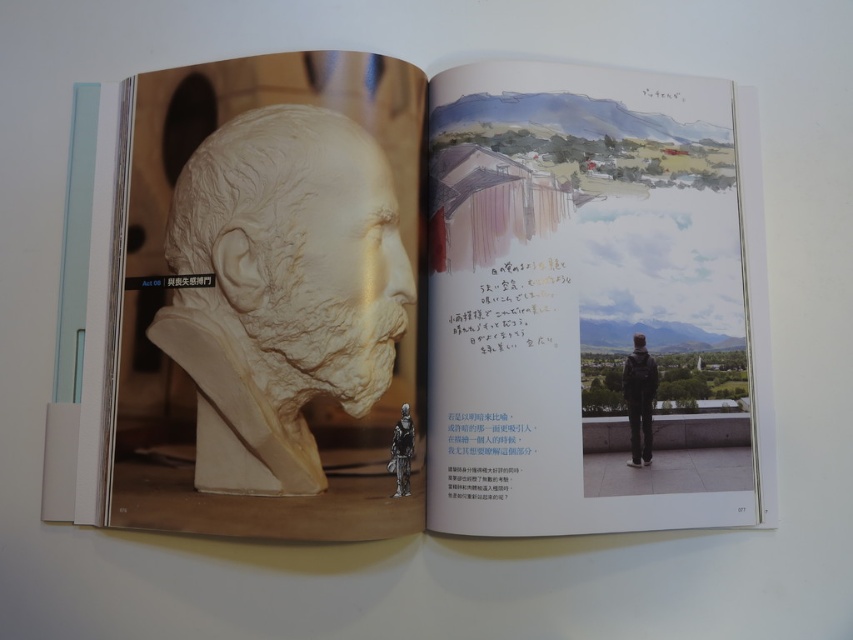
You are a photographer standing at the edge of a room where the open book is displayed. You want to take a clear photo of the white clay bust at left without any blur. Considering your camera requires a minimum distance of 24 inches to focus properly, can you take the photo from your current position?

The white clay bust at left and viewer are 25.56 inches apart, which is more than the required 24 inches. Therefore, you can take a clear photo of the white clay bust at left without any blur from your current position.

You are a photographer standing at the center of the book. You need to take a photo of the white clay bust at left. Which direction should you face to capture it properly?

The white clay bust at left is located at point (425, 300), which means it is positioned slightly to the left and center of the book. To capture it properly, you should face towards the left side of the book where the white clay bust at left is situated.